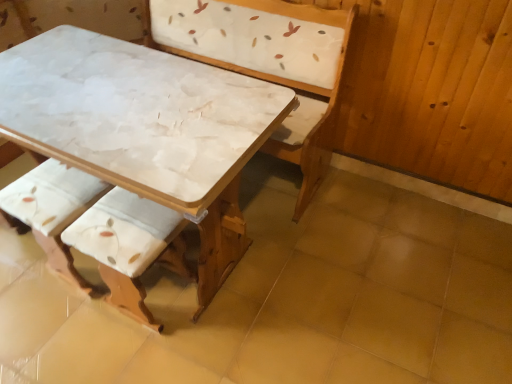
You are a GUI agent. You are given a task and a screenshot of the screen. Output one action in this format:
    pyautogui.click(x=<x>, y=<y>)
    Task: Click on the blank space situated above white marble table at center (from a real-world perspective)
    The width and height of the screenshot is (512, 384).
    Given the screenshot: What is the action you would take?
    pyautogui.click(x=120, y=97)